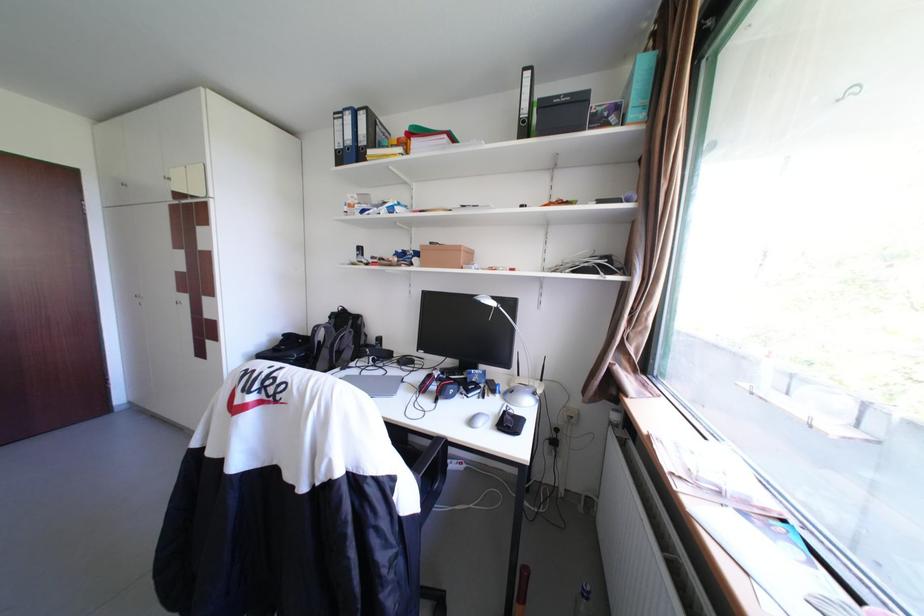
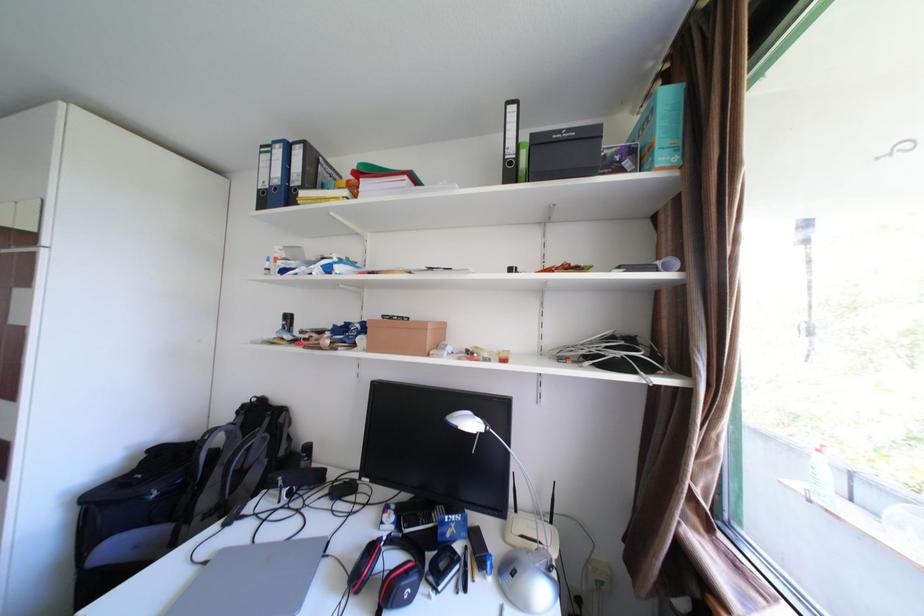
Question: What movement of the cameraman would produce the second image?

Choices:
 (A) Left
 (B) Right
 (C) Forward
 (D) Backward

Answer: (C)